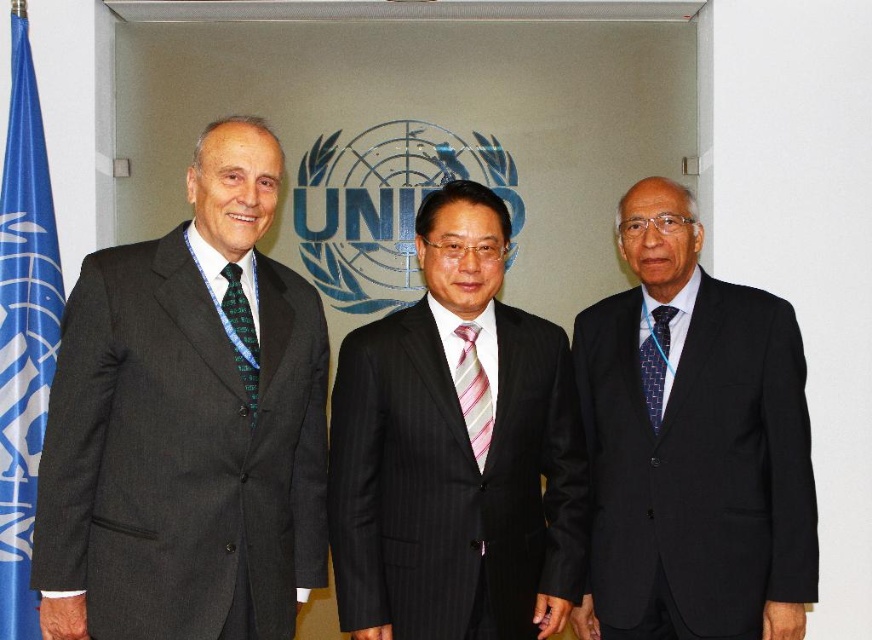
Question: Based on their relative distances, which object is farther from the dark gray pinstripe suit at center?

Choices:
 (A) matte black suit at left
 (B) blue fabric flag at left
 (C) green textured tie at left

Answer: (B)

Question: Which object appears closest to the camera in this image?

Choices:
 (A) matte black suit at left
 (B) dark gray suit at right
 (C) green textured tie at left

Answer: (A)

Question: Does dark gray pinstripe suit at center appear under blue fabric flag at left?

Choices:
 (A) yes
 (B) no

Answer: (A)

Question: Can you confirm if matte black suit at left is positioned below blue fabric flag at left?

Choices:
 (A) no
 (B) yes

Answer: (B)

Question: Can you confirm if dark gray pinstripe suit at center is positioned above blue textured tie at right?

Choices:
 (A) yes
 (B) no

Answer: (B)

Question: Which is farther from the dark gray pinstripe suit at center?

Choices:
 (A) green textured tie at left
 (B) dark gray suit at right

Answer: (A)